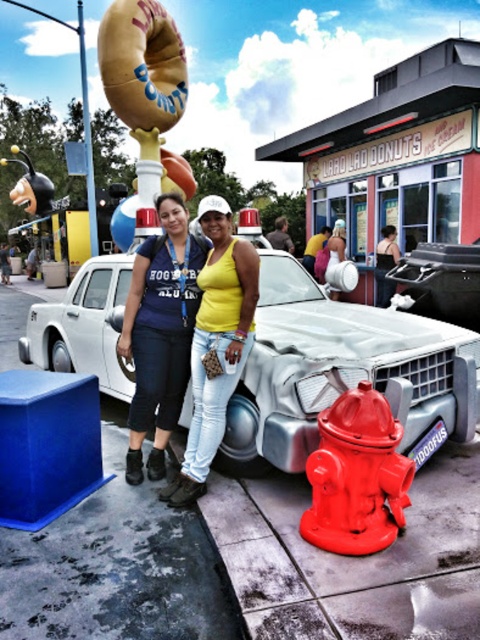
You are standing at the entrance of Laro Laro Donuts Ice Cream and want to find the yellow fabric shirt at center. According to the coordinates provided, where should you look relative to the entrance?

The yellow fabric shirt at center is located at coordinates point (314, 248) relative to the entrance, which means it is positioned to the right and slightly below the center point from the entrance.

You are a customer standing in front of the Laro Laro Donuts Ice Cream shop. You see a matte blue shirt at center and a shiny red fire hydrant at lower right. Which object is closer to your left side?

The matte blue shirt at center is to the left of the shiny red fire hydrant at lower right, so the matte blue shirt at center is closer to your left side.

You are a tailor measuring two items in the image. The yellow fabric shirt at center and the smooth leather jacket at center. Which item is closer to the other?

The yellow fabric shirt at center is 35.53 inches from the smooth leather jacket at center, so they are positioned at that distance from each other.